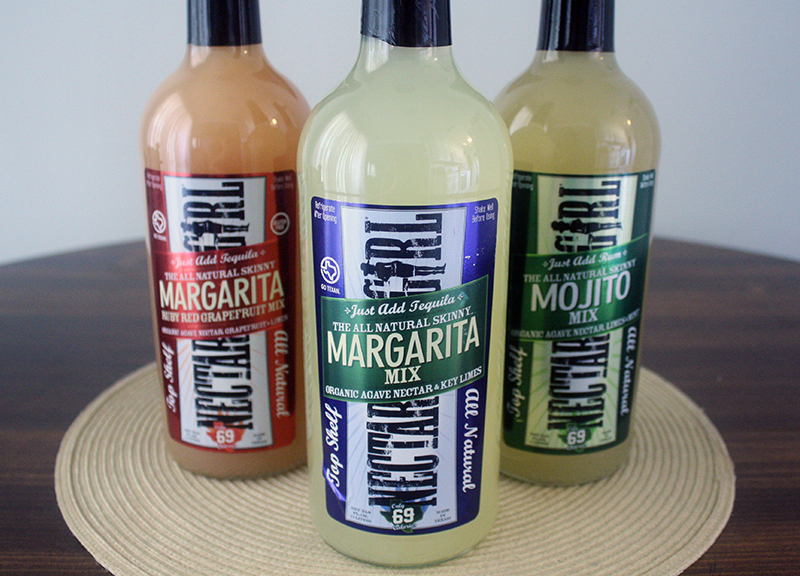
You are a GUI agent. You are given a task and a screenshot of the screen. Output one action in this format:
    pyautogui.click(x=<x>, y=<y>)
    Task: Click on the mat
    Image resolution: width=800 pixels, height=576 pixels.
    Given the screenshot: What is the action you would take?
    pyautogui.click(x=232, y=502)